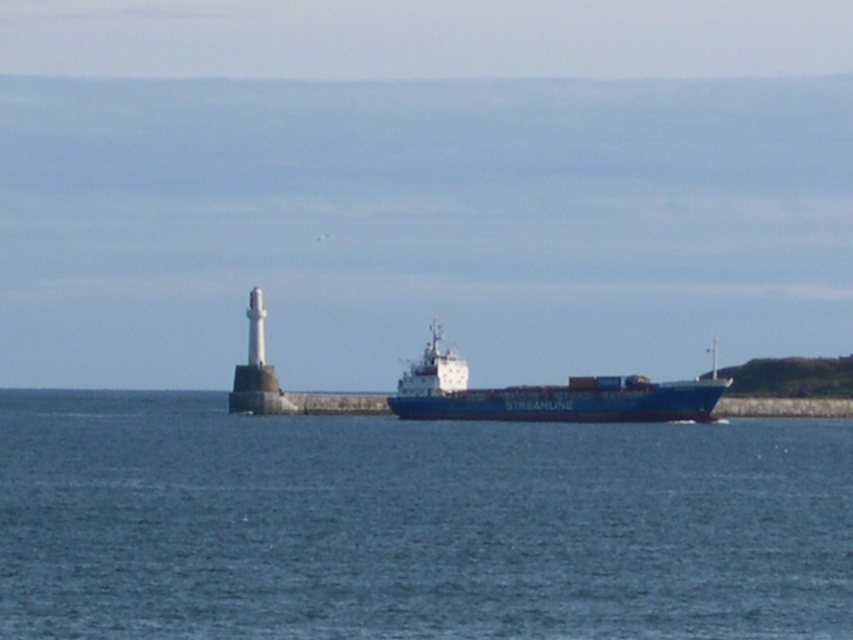
Based on the photo, you are a marine biologist observing the maritime scene. You need to determine if the blue water at center is wider than the blue matte container ship at center. Based on the scene, can you confirm this?

The blue water at center might be wider than blue matte container ship at center according to the description.

In the scene shown: You are a photographer taking a picture of the maritime scene. You notice two points marked in the image. Which point, point (332, 465) or point (432, 374), is closer to your camera lens?

Point (332, 465) is closer to the camera than point (432, 374).

You are a maritime photographer planning to capture the blue matte container ship at center and the blue water at center in a single frame. Based on the scene, which object should you focus on first to ensure both are in the frame?

The blue matte container ship at center occupies more space than the blue water at center, so focusing on the ship first will ensure both are in the frame.